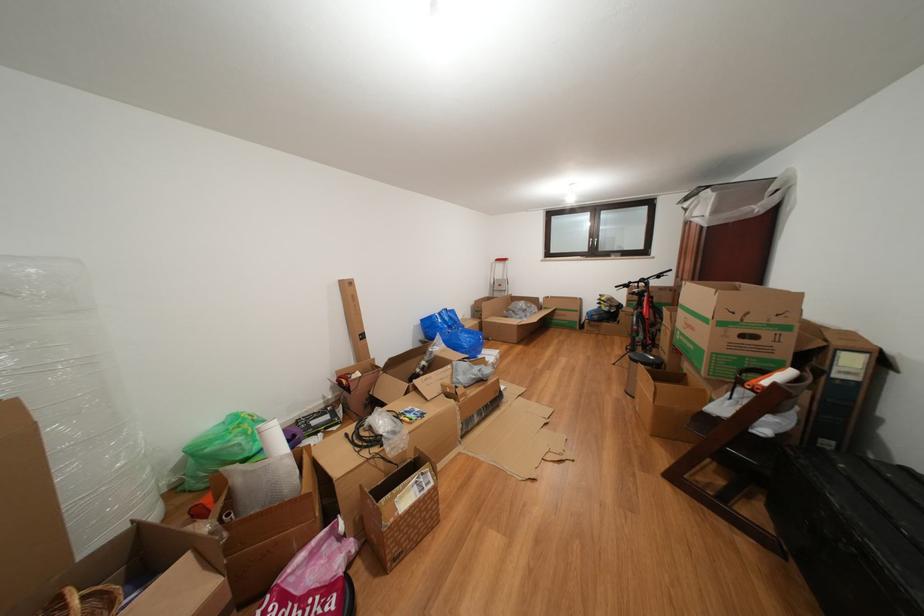
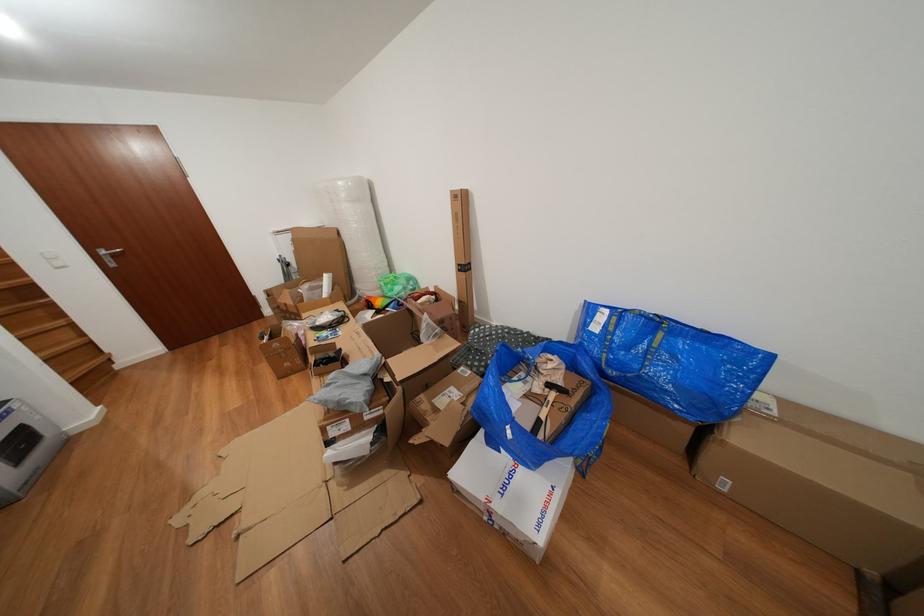
Locate, in the second image, the point that corresponds to point 370,345 in the first image.

(468, 276)